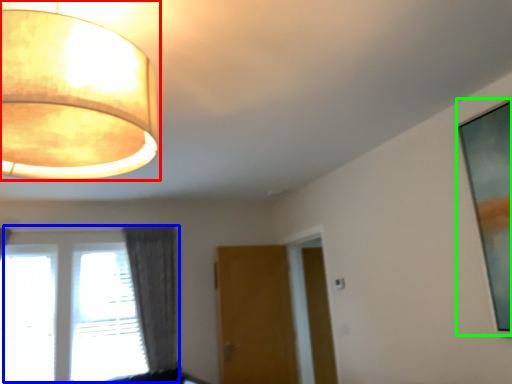
Question: Estimate the real-world distances between objects in this image. Which object is closer to lamp (highlighted by a red box), window (highlighted by a blue box) or picture frame (highlighted by a green box)?

Choices:
 (A) window
 (B) picture frame

Answer: (B)